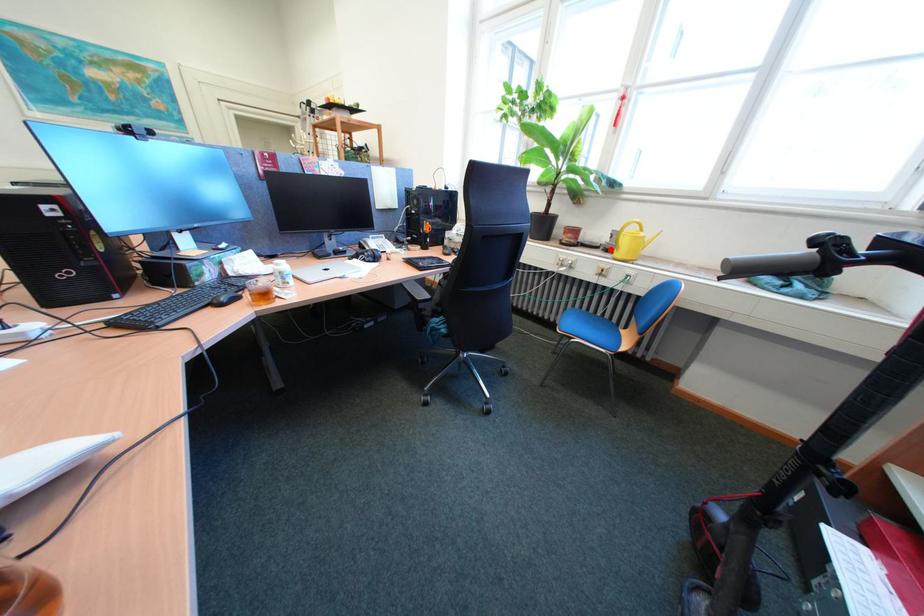
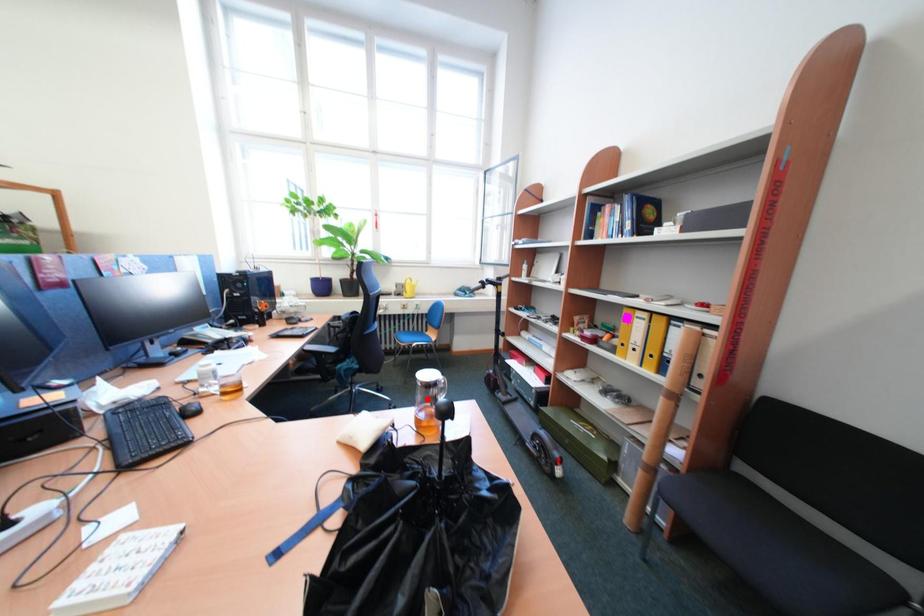
I am providing you with two images of the same scene from different viewpoints. A red point is marked on the first image and another point is marked on the second image. Are the points marked in image1 and image2 representing the same 3D position?

No